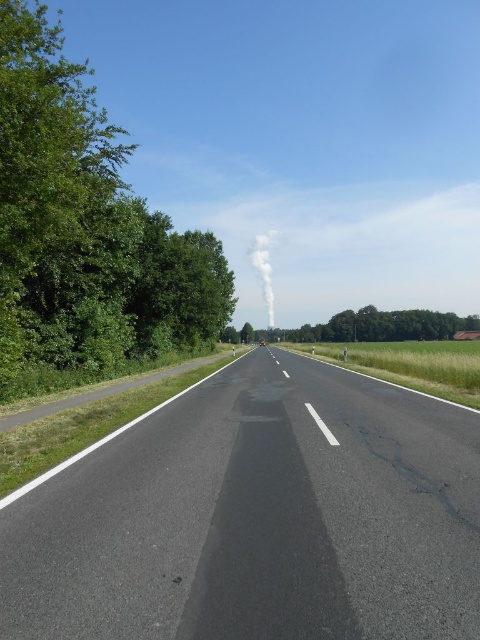
Question: Where is black asphalt road at center located in relation to white smoke at center in the image?

Choices:
 (A) right
 (B) left

Answer: (B)

Question: Which point is closer to the camera?

Choices:
 (A) white smoke at center
 (B) green leafy tree at center

Answer: (B)

Question: Can you confirm if green leafy tree at left is thinner than white smoke at center?

Choices:
 (A) yes
 (B) no

Answer: (B)

Question: Does black asphalt road at center have a lesser width compared to green leafy tree at left?

Choices:
 (A) no
 (B) yes

Answer: (B)

Question: Which point is closer to the camera taking this photo?

Choices:
 (A) (108, 340)
 (B) (267, 244)
 (C) (302, 326)
 (D) (62, 586)

Answer: (D)

Question: Which point is farther to the camera?

Choices:
 (A) (271, 278)
 (B) (446, 337)

Answer: (A)